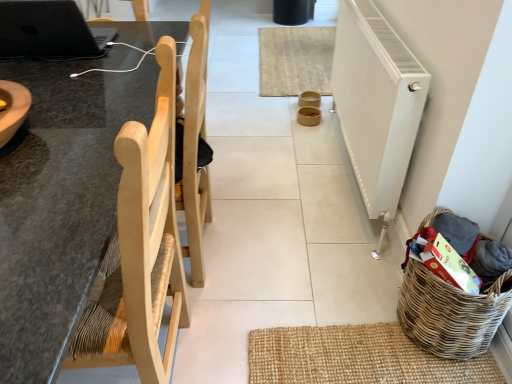
At what (x,y) coordinates should I click in order to perform the action: click on free spot to the left of white textured radiator at right. Please return your answer as a coordinate pair (x, y). This screenshot has height=384, width=512. Looking at the image, I should click on (279, 163).